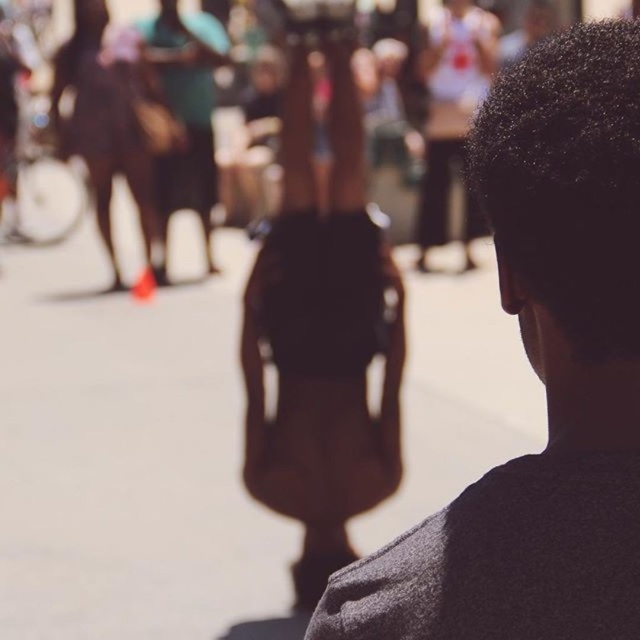
You are standing in the scene and want to move from the point at coordinates point (582, 202) to the point at coordinates point (364, 260). Which direction should you move to get closer to the blurred background?

To move from point (582, 202) to point (364, 260) and get closer to the blurred background, you should move forward since point (364, 260) is further away from the viewer than point (582, 202).

You are organizing a photo shoot and need to ensure that the dark gray sweater at center and the brown leather bag at center are visible in the final image. Given their positions, which object should be placed to the left to avoid obstruction?

The brown leather bag at center should be placed to the left because the dark gray sweater at center is currently on its right side, so moving the bag left would prevent obstruction.